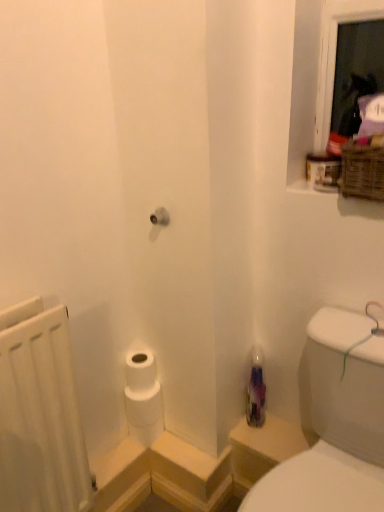
Where is `free spot in front of translucent purple bottle at lower right`? This screenshot has height=512, width=384. free spot in front of translucent purple bottle at lower right is located at coordinates (259, 437).